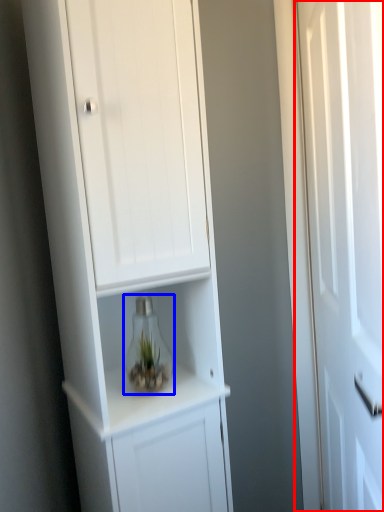
Question: Which of the following is the farthest to the observer, door (highlighted by a red box) or glass vase (highlighted by a blue box)?

Choices:
 (A) door
 (B) glass vase

Answer: (B)